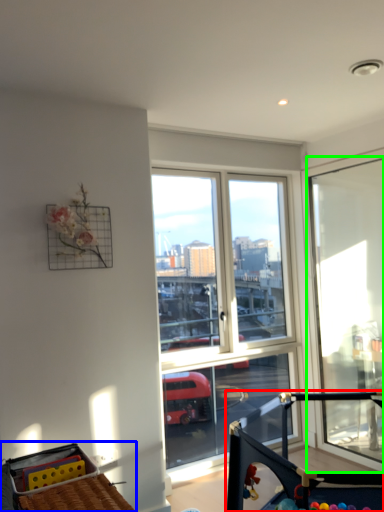
Question: Estimate the real-world distances between objects in this image. Which object is closer to baby carriage (highlighted by a red box), baby carriage (highlighted by a blue box) or window (highlighted by a green box)?

Choices:
 (A) baby carriage
 (B) window

Answer: (A)